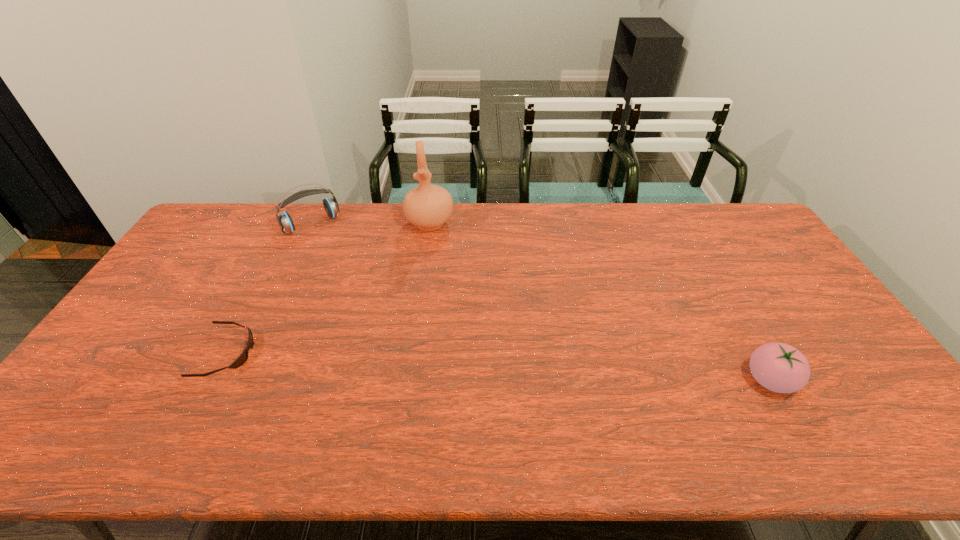
This screenshot has height=540, width=960. I want to click on sunglasses, so click(x=243, y=357).

Where is `the rightmost object`? The height and width of the screenshot is (540, 960). the rightmost object is located at coordinates (779, 367).

At what (x,y) coordinates should I click in order to perform the action: click on tomato. Please return your answer as a coordinate pair (x, y). Looking at the image, I should click on (779, 367).

This screenshot has height=540, width=960. Find the location of `headset`. headset is located at coordinates (331, 206).

Where is `the third object from left to right`? the third object from left to right is located at coordinates (428, 207).

Where is `pottery`? pottery is located at coordinates (428, 207).

Where is `free space located on the front-facing side of the sunglasses`? The image size is (960, 540). free space located on the front-facing side of the sunglasses is located at coordinates (397, 353).

Locate an element on the screen. This screenshot has width=960, height=540. vacant space located 0.100m on the right of the second shortest object is located at coordinates (834, 380).

Locate an element on the screen. The image size is (960, 540). vacant point located 0.300m on the ear cups of the headset is located at coordinates (358, 284).

Locate an element on the screen. free space located 0.160m on the ear cups of the headset is located at coordinates (340, 259).